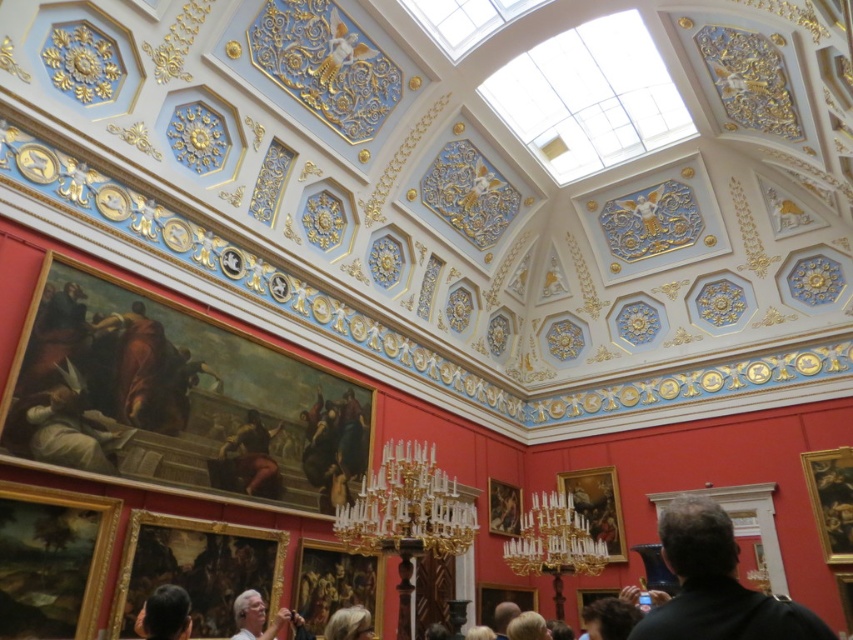
Does white hair at lower center have a smaller size compared to blonde hair at lower center?

Indeed, white hair at lower center has a smaller size compared to blonde hair at lower center.

Is white hair at lower center bigger than blonde hair at lower center?

No.

Locate an element on the screen. white hair at lower center is located at coordinates (258, 618).

At what (x,y) coordinates should I click in order to perform the action: click on white hair at lower center. Please return your answer as a coordinate pair (x, y). Looking at the image, I should click on (258, 618).

Consider the image. How distant is gold plated chandelier at center from white hair at lower center?

gold plated chandelier at center and white hair at lower center are 7.34 meters apart from each other.

Does gold plated chandelier at center have a lesser height compared to white hair at lower center?

Incorrect, gold plated chandelier at center's height does not fall short of white hair at lower center's.

This screenshot has width=853, height=640. What are the coordinates of `gold plated chandelier at center` in the screenshot? It's located at (405, 506).

Between point (178, 589) and point (254, 596), which one is positioned in front?

Point (178, 589) is in front.

Is dark brown hair at lower left shorter than white hair at lower center?

Yes, dark brown hair at lower left is shorter than white hair at lower center.

Does point (190, 630) lie in front of point (242, 605)?

Yes, point (190, 630) is in front of point (242, 605).

Where is `dark brown hair at lower left`? This screenshot has width=853, height=640. dark brown hair at lower left is located at coordinates (164, 614).